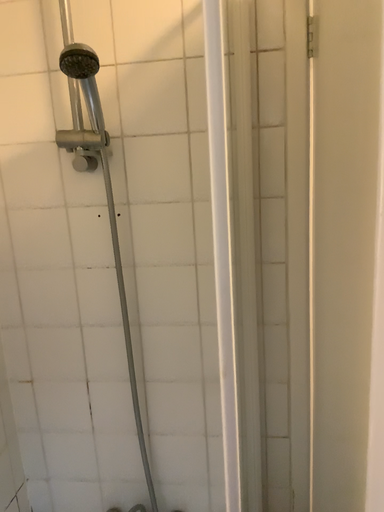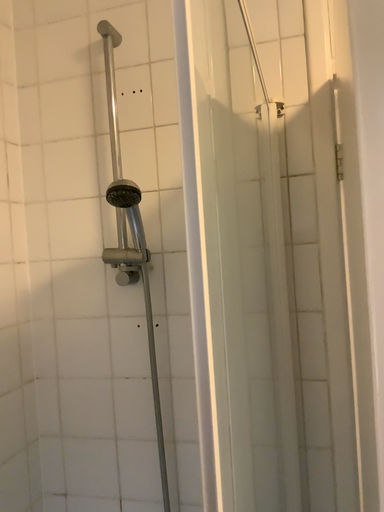
Question: How did the camera likely rotate when shooting the video?

Choices:
 (A) rotated left
 (B) rotated right

Answer: (A)